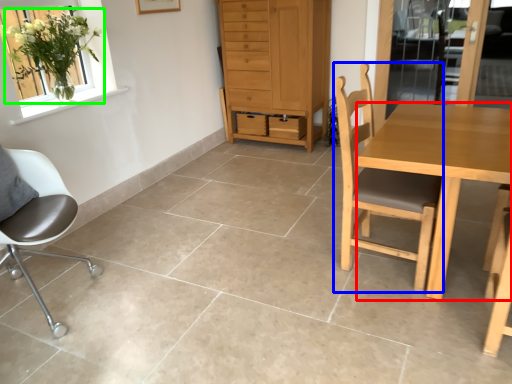
Question: Which object is the closest to the desk (highlighted by a red box)? Choose among these: chair (highlighted by a blue box) or houseplant (highlighted by a green box).

Choices:
 (A) chair
 (B) houseplant

Answer: (A)